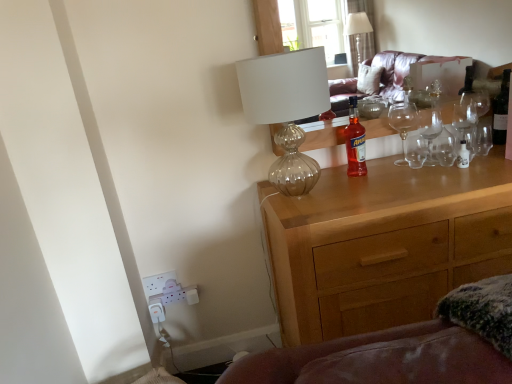
Where is `free space in front of translucent glass lamp at upper center`? The image size is (512, 384). free space in front of translucent glass lamp at upper center is located at coordinates (324, 217).